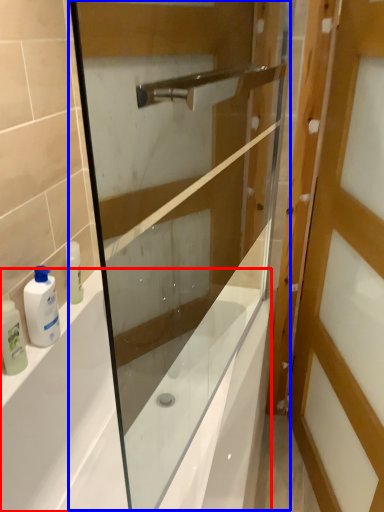
Question: Among these objects, which one is nearest to the camera, bath (highlighted by a red box) or screen door (highlighted by a blue box)?

Choices:
 (A) bath
 (B) screen door

Answer: (B)